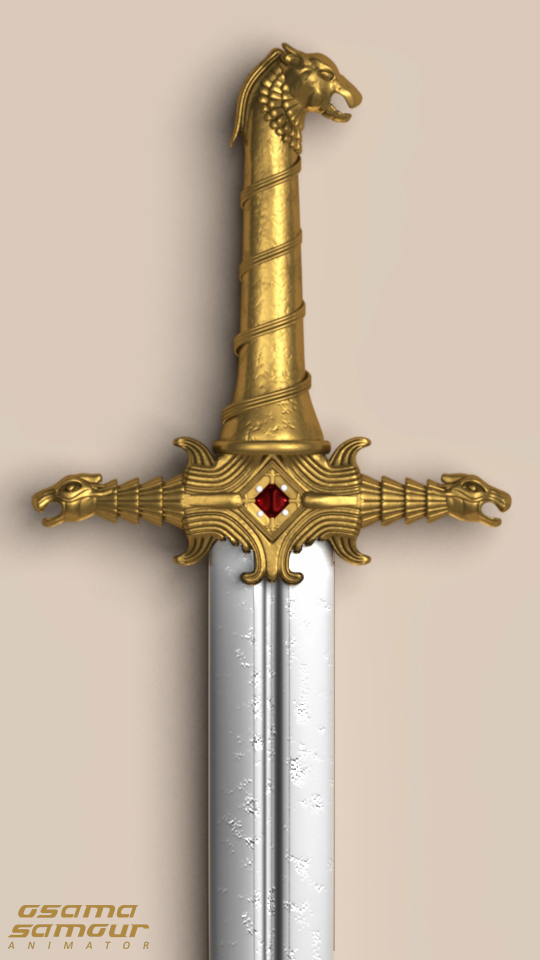
Where is `handle`? handle is located at coordinates (276, 200).